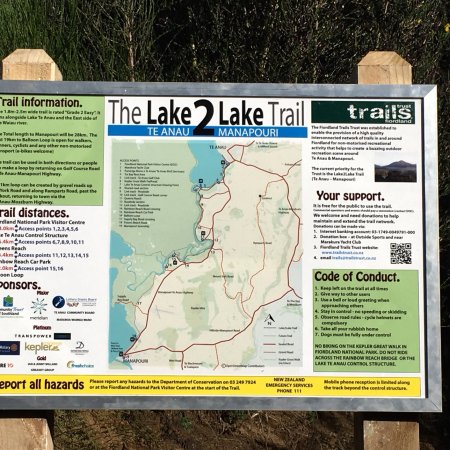
The height and width of the screenshot is (450, 450). Find the location of `wooden pillars`. wooden pillars is located at coordinates (392, 443), (27, 435).